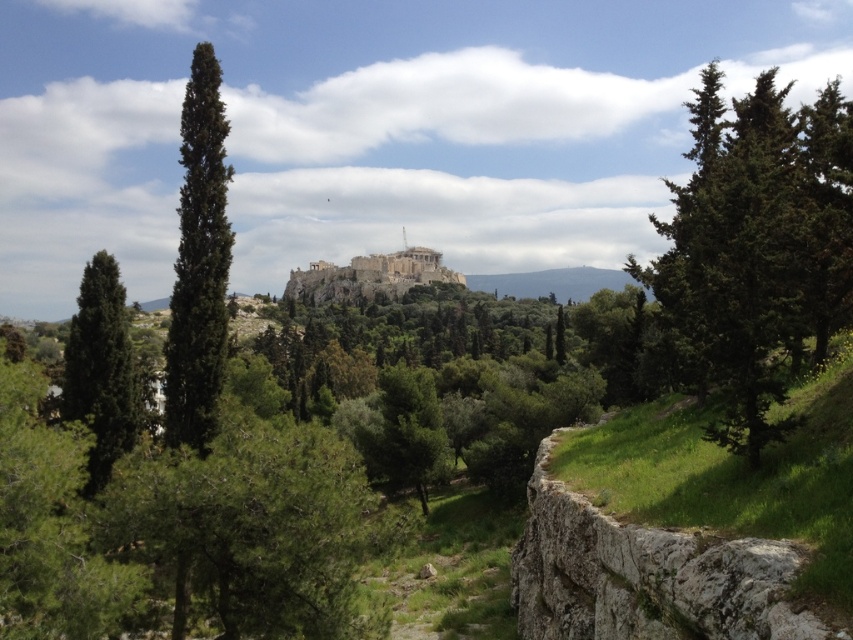
Can you confirm if green matte tree at left is thinner than stone/brick castle at center?

Yes.

Which is in front, point (120, 321) or point (405, 268)?

Point (120, 321) is in front.

Identify the location of green matte tree at left. The image size is (853, 640). (100, 369).

Locate an element on the screen. This screenshot has width=853, height=640. green matte tree at left is located at coordinates (100, 369).

Which is above, green leafy tree at right or stone/brick castle at center?

Positioned higher is green leafy tree at right.

Which is more to the right, green leafy tree at right or stone/brick castle at center?

Positioned to the right is green leafy tree at right.

The height and width of the screenshot is (640, 853). What do you see at coordinates (756, 250) in the screenshot?
I see `green leafy tree at right` at bounding box center [756, 250].

Identify the location of green leafy tree at right. (756, 250).

Does green leafy tree at right have a smaller size compared to green textured tree at left?

No.

Is point (728, 225) in front of point (206, 144)?

Yes.

Between point (772, 324) and point (222, 264), which one is positioned in front?

Point (772, 324) is more forward.

You are a GUI agent. You are given a task and a screenshot of the screen. Output one action in this format:
    pyautogui.click(x=<x>, y=<y>)
    Task: Click on the green leafy tree at right
    The height and width of the screenshot is (640, 853).
    Given the screenshot: What is the action you would take?
    pyautogui.click(x=756, y=250)